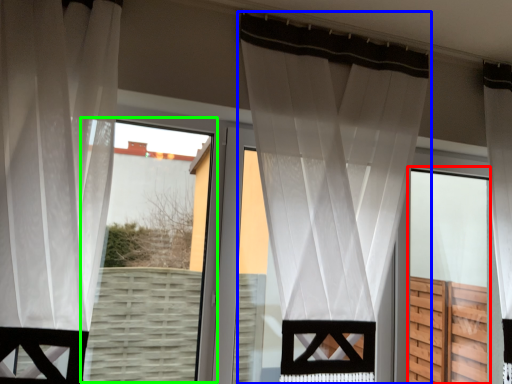
Question: Which object is the closest to the screen door (highlighted by a red box)? Choose among these: curtain (highlighted by a blue box) or bay window (highlighted by a green box).

Choices:
 (A) curtain
 (B) bay window

Answer: (A)